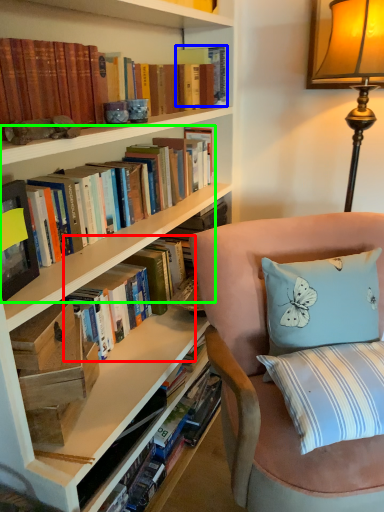
Question: Considering the real-world distances, which object is closest to book (highlighted by a red box)? paperback book (highlighted by a blue box) or book (highlighted by a green box).

Choices:
 (A) paperback book
 (B) book

Answer: (B)